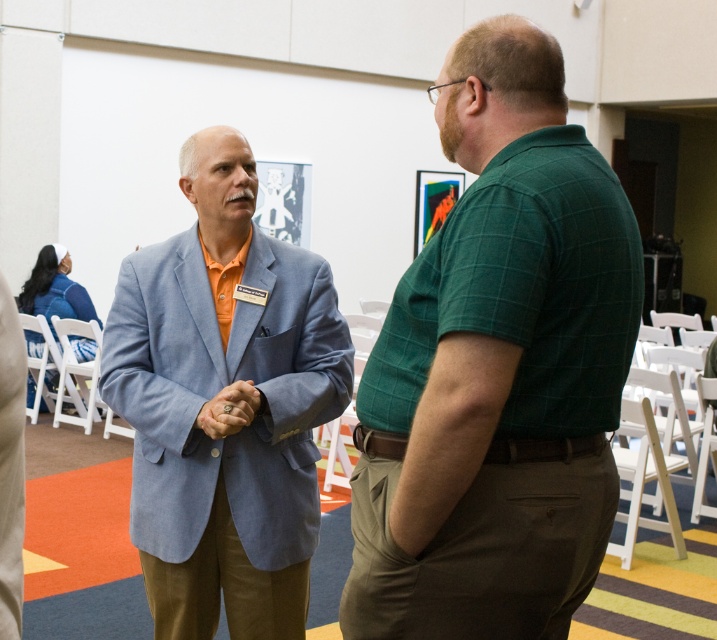
In the scene shown: You are organizing a conference and need to place a name tag holder next to the light blue fabric blazer at center and the matte gold ring at center. According to their positions, where should you place the name tag holder so it is between them?

The name tag holder should be placed between the light blue fabric blazer at center and the matte gold ring at center, aligning it to the right of the light blue fabric blazer at center and to the left of the matte gold ring at center since the blazer is on the left side of the ring.

You are organizing a photo shoot and need to decide which clothing item to feature first based on their sizes. Given the green checkered shirt at right and the light blue fabric blazer at center, which one should you choose if you want to highlight the larger garment first?

The light blue fabric blazer at center should be highlighted first since its width is greater than the green checkered shirt at right.

You are organizing a photo shoot in the conference room and need to position a 1.8m tall tripod between the green checkered shirt at right and the matte gold ring at center. Based on their heights, will the tripod be taller than both objects?

The green checkered shirt at right is taller than the matte gold ring at center. Since the tripod is 1.8m tall, it will be taller than both objects as the green checkered shirt at right is the taller one between them.